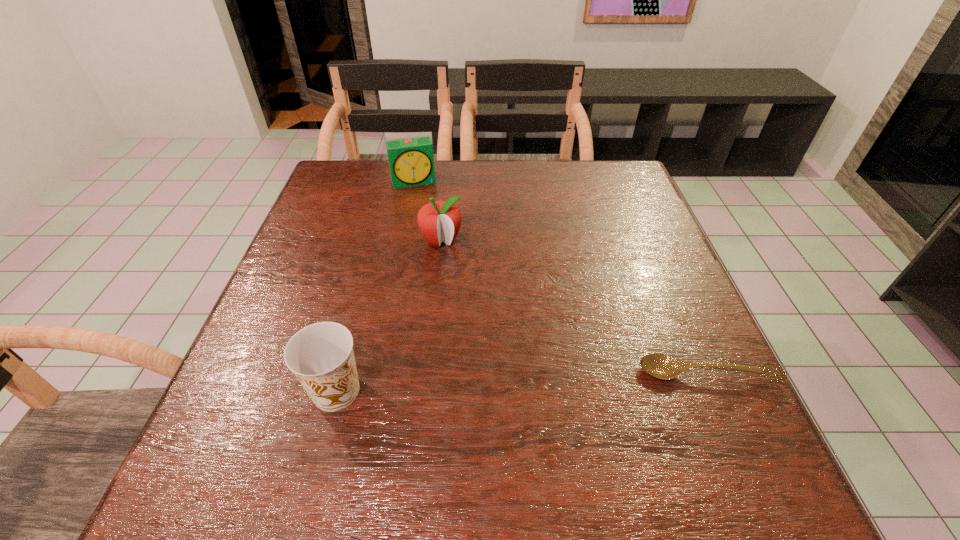
This screenshot has width=960, height=540. Identify the location of free spot on the desktop that is between the Dixie cup and the shortest object and is positioned on the front-facing side of the farthest object. (470, 384).

Locate an element on the screen. This screenshot has width=960, height=540. free space on the desktop that is between the Dixie cup and the shortest object and is positioned on the side where a bite is taken out of the apple is located at coordinates (483, 384).